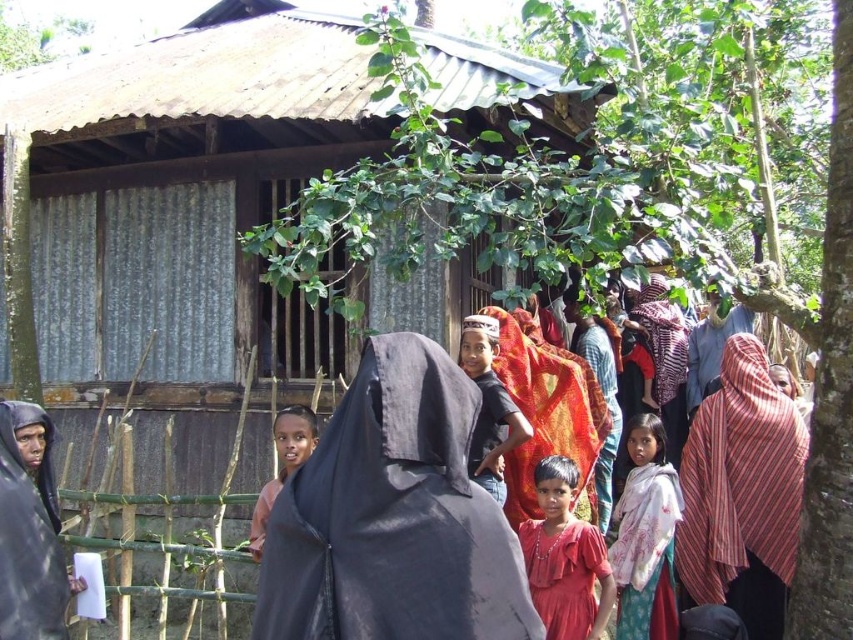
Question: Considering the real-world distances, which object is closest to the striped fabric headscarf at center?

Choices:
 (A) white floral fabric at center
 (B) black matte veil at center

Answer: (A)

Question: Which point is farther to the camera?

Choices:
 (A) white floral fabric at center
 (B) striped fabric headscarf at center

Answer: (B)

Question: Is black matte veil at center to the right of striped fabric headscarf at center from the viewer's perspective?

Choices:
 (A) yes
 (B) no

Answer: (B)

Question: Among these objects, which one is nearest to the camera?

Choices:
 (A) black matte veil at center
 (B) white floral fabric at center

Answer: (A)

Question: Is black matte veil at center to the left of striped fabric headscarf at center from the viewer's perspective?

Choices:
 (A) yes
 (B) no

Answer: (A)

Question: Can you confirm if black matte veil at center is positioned below striped fabric headscarf at center?

Choices:
 (A) no
 (B) yes

Answer: (A)